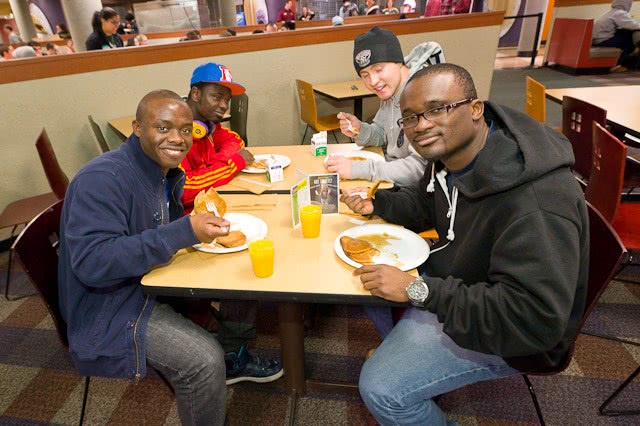
Where is `tabletop`? The height and width of the screenshot is (426, 640). tabletop is located at coordinates (632, 106), (273, 211), (292, 162), (345, 86), (124, 121).